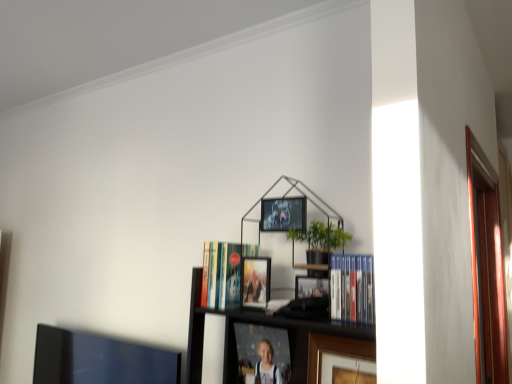
I want to click on gold-framed photo at center, acting as the second picture frame starting from the bottom, so click(335, 352).

At what (x,y) coordinates should I click in order to perform the action: click on metallic silver picture frame at upper center, which is the fourth picture frame from bottom to top. Please return your answer as a coordinate pair (x, y). Looking at the image, I should click on (283, 214).

The height and width of the screenshot is (384, 512). What do you see at coordinates (283, 214) in the screenshot?
I see `metallic silver picture frame at upper center, marked as the first picture frame in a top-to-bottom arrangement` at bounding box center [283, 214].

What do you see at coordinates (255, 282) in the screenshot? I see `matte black picture frame at center, arranged as the third picture frame when ordered from the bottom` at bounding box center [255, 282].

The image size is (512, 384). What do you see at coordinates (260, 355) in the screenshot?
I see `matte plastic picture frame at center, the 1th picture frame in the bottom-to-top sequence` at bounding box center [260, 355].

Measure the distance between point (469, 164) and camera.

Point (469, 164) is 1.59 meters away from camera.

At what (x,y) coordinates should I click in order to perform the action: click on gold-framed photo at center, which appears as the third picture frame when viewed from the top. Please return your answer as a coordinate pair (x, y). Image resolution: width=512 pixels, height=384 pixels. Looking at the image, I should click on (335, 352).

Which object is positioned more to the left, hardcover book at center, which is the 2th book in right-to-left order, or gold-framed photo at center, acting as the second picture frame starting from the bottom?

Positioned to the left is hardcover book at center, which is the 2th book in right-to-left order.

Does hardcover book at center, positioned as the second book in front-to-back order, touch gold-framed photo at center, which appears as the third picture frame when viewed from the top?

No, hardcover book at center, positioned as the second book in front-to-back order, is not touching gold-framed photo at center, which appears as the third picture frame when viewed from the top.

Considering the relative sizes of hardcover book at center, the 1th book viewed from the left, and gold-framed photo at center, acting as the second picture frame starting from the bottom, in the image provided, is hardcover book at center, the 1th book viewed from the left, shorter than gold-framed photo at center, acting as the second picture frame starting from the bottom,?

Correct, hardcover book at center, the 1th book viewed from the left, is not as tall as gold-framed photo at center, acting as the second picture frame starting from the bottom.

Which is in front, point (205, 305) or point (353, 342)?

Point (353, 342)

Which is more to the left, metallic silver picture frame at upper center, which is the fourth picture frame from bottom to top, or hardcover book at center, which is the 2th book in right-to-left order?

hardcover book at center, which is the 2th book in right-to-left order, is more to the left.

In the scene shown: Between metallic silver picture frame at upper center, which is the fourth picture frame from bottom to top, and hardcover book at center, which is the 2th book in right-to-left order, which one is positioned in front?

Positioned in front is metallic silver picture frame at upper center, which is the fourth picture frame from bottom to top.

Could you measure the distance between metallic silver picture frame at upper center, marked as the first picture frame in a top-to-bottom arrangement, and hardcover book at center, which is the 2th book in right-to-left order?

They are 7.40 inches apart.

Which of these two, metallic silver picture frame at upper center, which is the fourth picture frame from bottom to top, or hardcover book at center, the 1th book viewed from the left, stands shorter?

metallic silver picture frame at upper center, which is the fourth picture frame from bottom to top.

Considering the relative sizes of metallic silver picture frame at upper center, which is the fourth picture frame from bottom to top, and transparent glass door at right in the image provided, is metallic silver picture frame at upper center, which is the fourth picture frame from bottom to top, smaller than transparent glass door at right?

Indeed, metallic silver picture frame at upper center, which is the fourth picture frame from bottom to top, has a smaller size compared to transparent glass door at right.

At what (x,y) coordinates should I click in order to perform the action: click on glass door that appears below the metallic silver picture frame at upper center, which is the fourth picture frame from bottom to top (from a real-world perspective). Please return your answer as a coordinate pair (x, y). Looking at the image, I should click on (487, 267).

Is metallic silver picture frame at upper center, marked as the first picture frame in a top-to-bottom arrangement, oriented towards transparent glass door at right?

No, metallic silver picture frame at upper center, marked as the first picture frame in a top-to-bottom arrangement, is not turned towards transparent glass door at right.

Is metallic silver picture frame at upper center, which is the fourth picture frame from bottom to top, positioned far away from transparent glass door at right?

No, metallic silver picture frame at upper center, which is the fourth picture frame from bottom to top, is in close proximity to transparent glass door at right.

Can you confirm if matte plastic picture frame at center, the 1th picture frame in the bottom-to-top sequence, is taller than hardcover book at center, the 1th book viewed from the left?

Yes.

From a real-world perspective, is matte plastic picture frame at center, which is the 4th picture frame in top-to-bottom order, positioned under hardcover book at center, positioned as the second book in front-to-back order, based on gravity?

Yes, from a real-world perspective, matte plastic picture frame at center, which is the 4th picture frame in top-to-bottom order, is below hardcover book at center, positioned as the second book in front-to-back order.

How many degrees apart are the facing directions of matte plastic picture frame at center, the 1th picture frame in the bottom-to-top sequence, and hardcover book at center, which is the 2th book in right-to-left order?

The facing directions of matte plastic picture frame at center, the 1th picture frame in the bottom-to-top sequence, and hardcover book at center, which is the 2th book in right-to-left order, are 3.88 degrees apart.

Can you confirm if metallic silver picture frame at upper center, marked as the first picture frame in a top-to-bottom arrangement, is shorter than matte plastic picture frame at center, the 1th picture frame in the bottom-to-top sequence?

Indeed, metallic silver picture frame at upper center, marked as the first picture frame in a top-to-bottom arrangement, has a lesser height compared to matte plastic picture frame at center, the 1th picture frame in the bottom-to-top sequence.

Does metallic silver picture frame at upper center, marked as the first picture frame in a top-to-bottom arrangement, appear on the right side of matte plastic picture frame at center, the 1th picture frame in the bottom-to-top sequence?

Correct, you'll find metallic silver picture frame at upper center, marked as the first picture frame in a top-to-bottom arrangement, to the right of matte plastic picture frame at center, the 1th picture frame in the bottom-to-top sequence.

From a real-world perspective, between metallic silver picture frame at upper center, which is the fourth picture frame from bottom to top, and matte plastic picture frame at center, the 1th picture frame in the bottom-to-top sequence, who is vertically higher?

From a 3D spatial view, metallic silver picture frame at upper center, which is the fourth picture frame from bottom to top, is above.

Is metallic silver picture frame at upper center, marked as the first picture frame in a top-to-bottom arrangement, bigger or smaller than matte plastic picture frame at center, the 1th picture frame in the bottom-to-top sequence?

Considering their sizes, metallic silver picture frame at upper center, marked as the first picture frame in a top-to-bottom arrangement, takes up less space than matte plastic picture frame at center, the 1th picture frame in the bottom-to-top sequence.

Does matte plastic picture frame at center, which is the 4th picture frame in top-to-bottom order, lie behind matte black picture frame at center, positioned as the 2th picture frame in top-to-bottom order?

Yes, it is behind matte black picture frame at center, positioned as the 2th picture frame in top-to-bottom order.

From the image's perspective, count 2nd picture frames upward from the matte plastic picture frame at center, the 1th picture frame in the bottom-to-top sequence, and point to it. Please provide its 2D coordinates.

[(255, 282)]

Between point (258, 377) and point (241, 294), which one is positioned in front?

The point (241, 294) is in front.

From the image's perspective, which one is positioned lower, matte plastic picture frame at center, which is the 4th picture frame in top-to-bottom order, or blue hardcover books at center-right, which is the 2th book from left to right?

matte plastic picture frame at center, which is the 4th picture frame in top-to-bottom order, from the image's perspective.

Between matte plastic picture frame at center, which is the 4th picture frame in top-to-bottom order, and blue hardcover books at center-right, the first book from the right, which one has less height?

With less height is blue hardcover books at center-right, the first book from the right.

Can you confirm if matte plastic picture frame at center, the 1th picture frame in the bottom-to-top sequence, is bigger than blue hardcover books at center-right, the first book from the right?

Indeed, matte plastic picture frame at center, the 1th picture frame in the bottom-to-top sequence, has a larger size compared to blue hardcover books at center-right, the first book from the right.

Identify the location of book that is the 2nd object to the left of the gold-framed photo at center, which appears as the third picture frame when viewed from the top, starting at the anchor. The image size is (512, 384). (223, 273).

Locate an element on the screen. the 3rd picture frame to the right when counting from the hardcover book at center, the 1th book viewed from the left is located at coordinates (283, 214).

Which object lies further to the anchor point hardcover book at center, which is the 2th book in right-to-left order, blue hardcover books at center-right, positioned as the second book in back-to-front order, or gold-framed photo at center, which appears as the third picture frame when viewed from the top?

Among the two, blue hardcover books at center-right, positioned as the second book in back-to-front order, is located further to hardcover book at center, which is the 2th book in right-to-left order.

Based on their spatial positions, is matte black picture frame at center, arranged as the third picture frame when ordered from the bottom, or gold-framed photo at center, acting as the second picture frame starting from the bottom, closer to transparent glass door at right?

gold-framed photo at center, acting as the second picture frame starting from the bottom, is closer to transparent glass door at right.

Looking at the image, which one is located closer to matte plastic picture frame at center, the 1th picture frame in the bottom-to-top sequence, matte black picture frame at center, positioned as the 2th picture frame in top-to-bottom order, or hardcover book at center, positioned as the second book in front-to-back order?

hardcover book at center, positioned as the second book in front-to-back order, lies closer to matte plastic picture frame at center, the 1th picture frame in the bottom-to-top sequence, than the other object.

Which object lies further to the anchor point hardcover book at center, the 1th book viewed from the left, transparent glass door at right or metallic silver picture frame at upper center, marked as the first picture frame in a top-to-bottom arrangement?

Among the two, transparent glass door at right is located further to hardcover book at center, the 1th book viewed from the left.

Based on their spatial positions, is matte black picture frame at center, arranged as the third picture frame when ordered from the bottom, or hardcover book at center, arranged as the first book when viewed from the back, closer to metallic silver picture frame at upper center, marked as the first picture frame in a top-to-bottom arrangement?

Among the two, matte black picture frame at center, arranged as the third picture frame when ordered from the bottom, is located nearer to metallic silver picture frame at upper center, marked as the first picture frame in a top-to-bottom arrangement.

From the picture: From the image, which object appears to be nearer to blue hardcover books at center-right, which is the 2th book from left to right, matte plastic picture frame at center, which is the 4th picture frame in top-to-bottom order, or gold-framed photo at center, acting as the second picture frame starting from the bottom?

gold-framed photo at center, acting as the second picture frame starting from the bottom, is positioned closer to the anchor blue hardcover books at center-right, which is the 2th book from left to right.

Looking at this image, estimate the real-world distances between objects in this image. Which object is closer to metallic silver picture frame at upper center, which is the fourth picture frame from bottom to top, matte plastic picture frame at center, which is the 4th picture frame in top-to-bottom order, or transparent glass door at right?

matte plastic picture frame at center, which is the 4th picture frame in top-to-bottom order.

From the image, which object appears to be farther from matte plastic picture frame at center, the 1th picture frame in the bottom-to-top sequence, hardcover book at center, the 1th book viewed from the left, or transparent glass door at right?

transparent glass door at right is further to matte plastic picture frame at center, the 1th picture frame in the bottom-to-top sequence.

Where is `book between matte black picture frame at center, arranged as the third picture frame when ordered from the bottom, and transparent glass door at right`? This screenshot has width=512, height=384. book between matte black picture frame at center, arranged as the third picture frame when ordered from the bottom, and transparent glass door at right is located at coordinates (x=352, y=288).

Identify the location of book between metallic silver picture frame at upper center, which is the fourth picture frame from bottom to top, and transparent glass door at right. (352, 288).

Locate an element on the screen. book between blue hardcover books at center-right, which is the 2th book from left to right, and matte plastic picture frame at center, which is the 4th picture frame in top-to-bottom order, in the vertical direction is located at coordinates (223, 273).

Where is `picture frame between metallic silver picture frame at upper center, marked as the first picture frame in a top-to-bottom arrangement, and transparent glass door at right from left to right`? This screenshot has height=384, width=512. picture frame between metallic silver picture frame at upper center, marked as the first picture frame in a top-to-bottom arrangement, and transparent glass door at right from left to right is located at coordinates (335, 352).